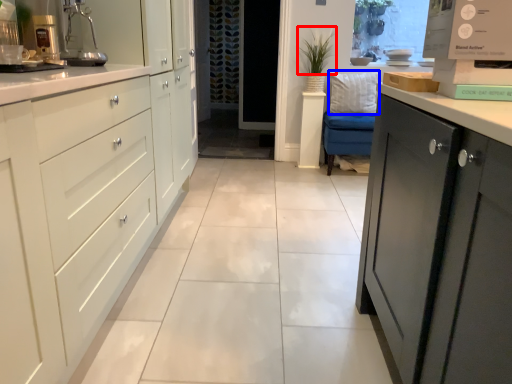
Question: Which of the following is the farthest to the observer, plant (highlighted by a red box) or pillow (highlighted by a blue box)?

Choices:
 (A) plant
 (B) pillow

Answer: (B)